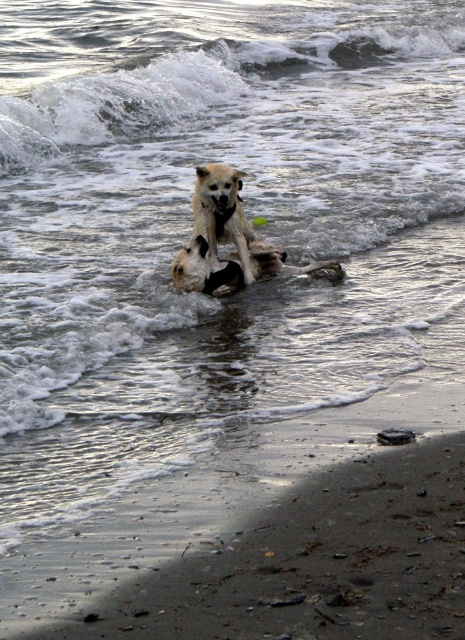
You are standing at the origin of the coordinate system on the beach. You see two points marked on the sand. Which point is closer to you, point (330,74) or point (178,253)?

Point (178,253) is closer to you because it is in front of point (330,74).

You are a photographer standing on the beach and want to capture both the white frothy wave at upper center and the light brown fur dog at center in the same frame. Given that your camera has a maximum zoom range of 5 meters, will you be able to include both subjects in a single photo without moving your position?

The white frothy wave at upper center and the light brown fur dog at center are 5.32 meters apart. Since the camera can only zoom up to 5 meters, it cannot capture both subjects in a single frame without moving closer or adjusting the angle.